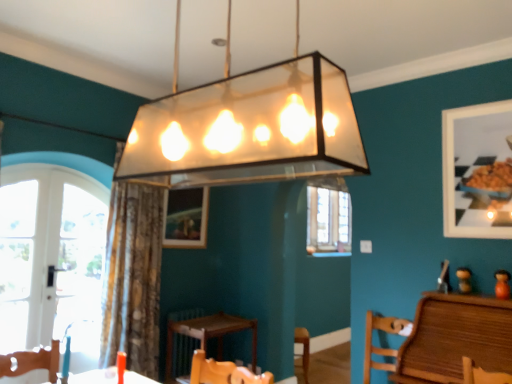
Question: In the image, is white glass door at left positioned in front of or behind wooden picture frame at center, the 2th picture frame in the right-to-left sequence?

Choices:
 (A) front
 (B) behind

Answer: (A)

Question: Considering the positions of white glass door at left and wooden picture frame at center, marked as the 2th picture frame in a front-to-back arrangement, in the image, is white glass door at left taller or shorter than wooden picture frame at center, marked as the 2th picture frame in a front-to-back arrangement,?

Choices:
 (A) tall
 (B) short

Answer: (A)

Question: Which of these objects is positioned farthest from the wooden picture frame at center, which ranks as the first picture frame in left-to-right order?

Choices:
 (A) matte white picture frame at upper right, arranged as the first picture frame when viewed from the right
 (B) white glass door at left
 (C) brown textured curtain at center
 (D) wooden chair at lower right
 (E) translucent glass pendant light at center

Answer: (E)

Question: Which object is the farthest from the wooden picture frame at center, which ranks as the first picture frame in left-to-right order?

Choices:
 (A) white glass door at left
 (B) wooden chair at lower right
 (C) brown textured curtain at center
 (D) translucent glass pendant light at center
 (E) matte white picture frame at upper right, the second picture frame positioned from the left

Answer: (D)